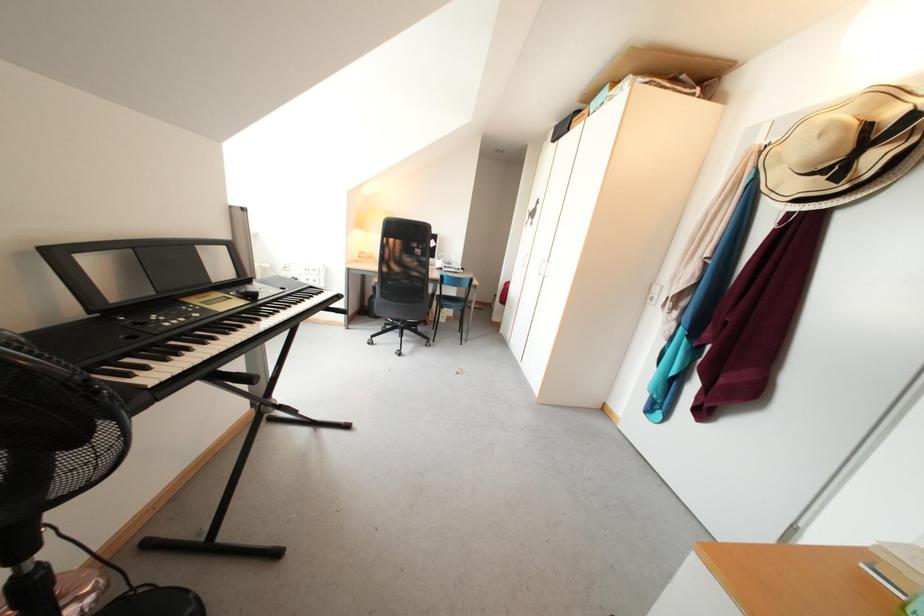
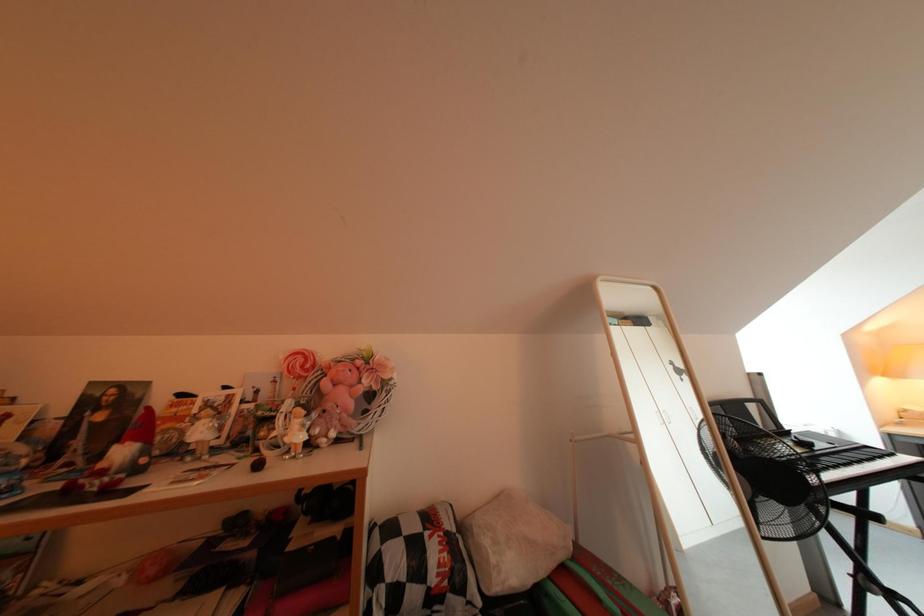
The first image is from the beginning of the video and the second image is from the end. How did the camera likely rotate when shooting the video?

The camera's rotation is toward left-up.